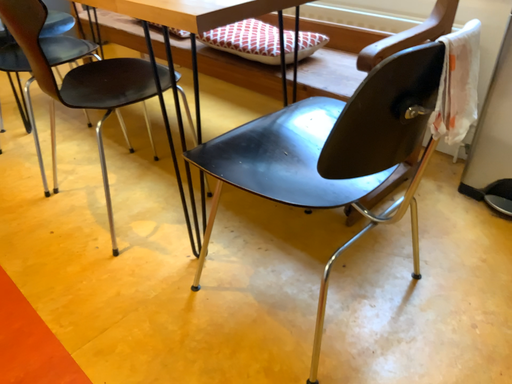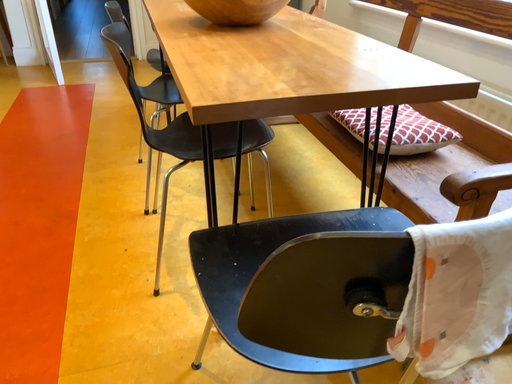
Question: Which way did the camera rotate in the video?

Choices:
 (A) rotated downward
 (B) rotated upward

Answer: (B)